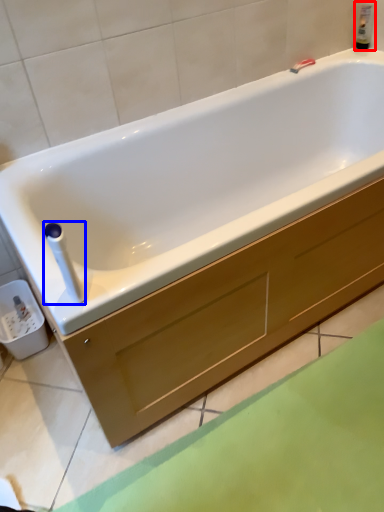
Question: Which point is further to the camera, bottle (highlighted by a red box) or towel bar (highlighted by a blue box)?

Choices:
 (A) bottle
 (B) towel bar

Answer: (A)